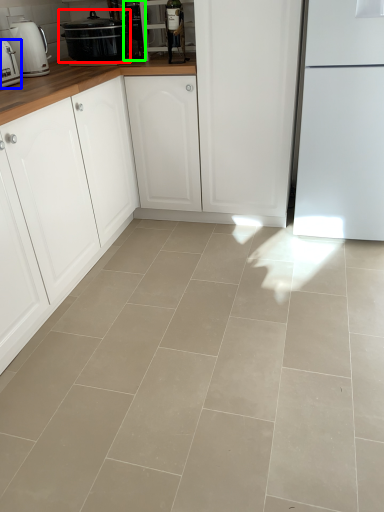
Question: Estimate the real-world distances between objects in this image. Which object is farther from home appliance (highlighted by a red box), kitchen appliance (highlighted by a blue box) or appliance (highlighted by a green box)?

Choices:
 (A) kitchen appliance
 (B) appliance

Answer: (A)